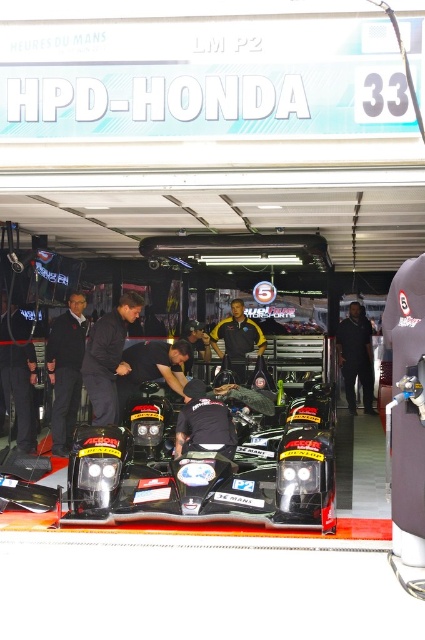
Which is in front, point (342, 344) or point (263, 344)?

Point (263, 344) is more forward.

Does black fabric man at center have a lesser height compared to yellow fabric shirt at center?

Incorrect, black fabric man at center's height does not fall short of yellow fabric shirt at center's.

Locate an element on the screen. The height and width of the screenshot is (640, 425). black fabric man at center is located at coordinates (356, 356).

Consider the image. Does black carbon fiber race car at center appear on the right side of dark blue fabric jacket at center?

Correct, you'll find black carbon fiber race car at center to the right of dark blue fabric jacket at center.

Looking at this image, does black carbon fiber race car at center appear over dark blue fabric jacket at center?

No.

Measure the distance between point (x=334, y=515) and camera.

Point (x=334, y=515) is 17.08 feet from camera.

Locate an element on the screen. The height and width of the screenshot is (640, 425). black carbon fiber race car at center is located at coordinates (193, 483).

Which is more to the right, black carbon fiber race car at center or black fabric man at center?

From the viewer's perspective, black fabric man at center appears more on the right side.

Find the location of a particular element. This screenshot has width=425, height=640. black carbon fiber race car at center is located at coordinates (193, 483).